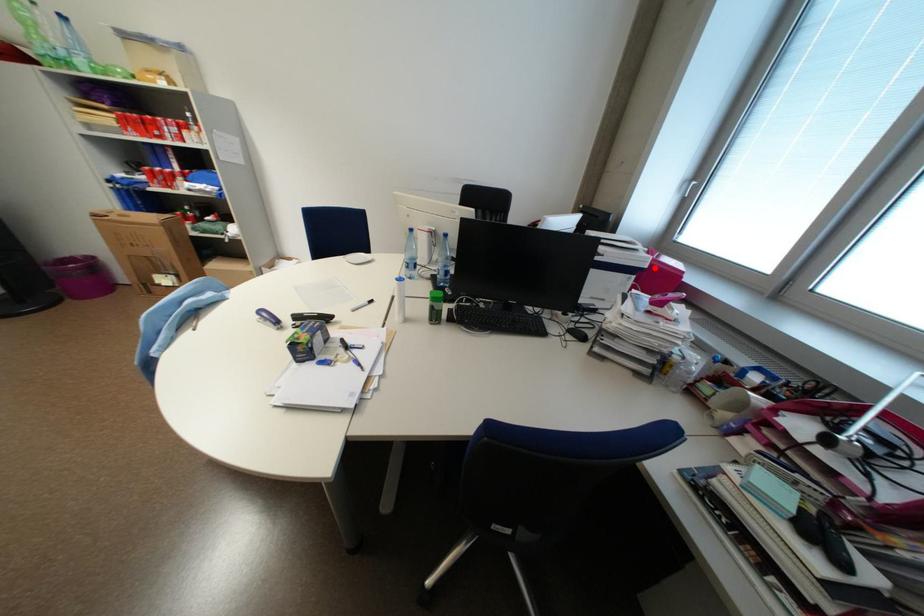
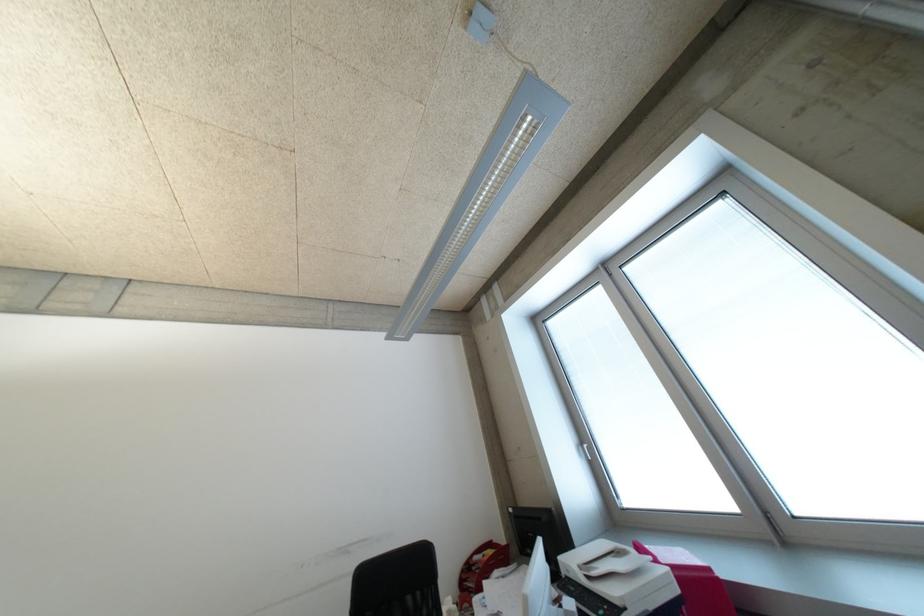
In the second image, find the point that corresponds to the highlighted location in the first image.

(687, 591)